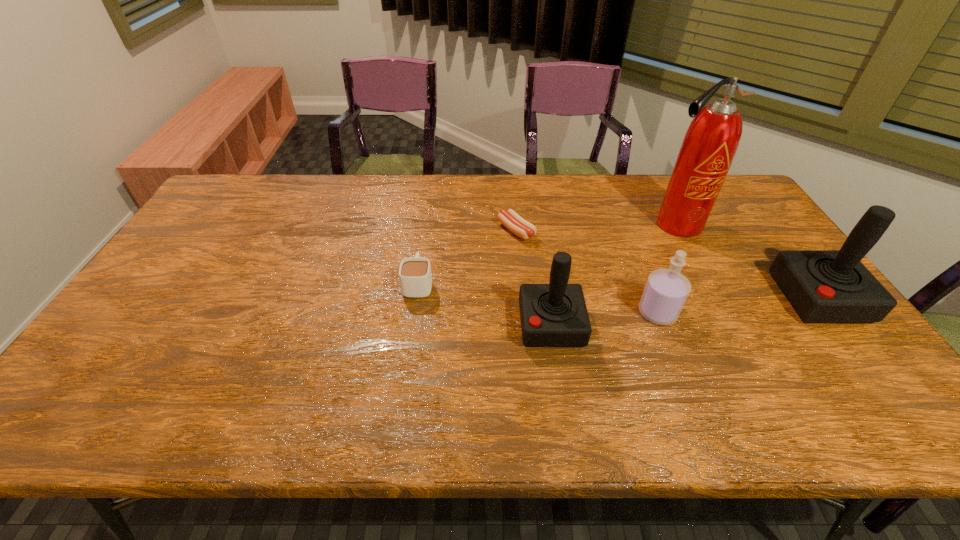
Where is `vacant area situated 0.240m on the back of the fourth object from left to right`? This screenshot has width=960, height=540. vacant area situated 0.240m on the back of the fourth object from left to right is located at coordinates (631, 242).

The width and height of the screenshot is (960, 540). In order to click on object located at the far edge in this screenshot , I will do `click(711, 141)`.

At what (x,y) coordinates should I click in order to perform the action: click on object that is at the right edge. Please return your answer as a coordinate pair (x, y). The width and height of the screenshot is (960, 540). Looking at the image, I should click on (823, 286).

The image size is (960, 540). I want to click on blank space at the far edge of the desktop, so click(x=552, y=179).

Where is `vacant space at the near edge of the desktop`? This screenshot has width=960, height=540. vacant space at the near edge of the desktop is located at coordinates (660, 355).

This screenshot has width=960, height=540. In order to click on vacant space at the far left corner of the desktop in this screenshot , I will do click(x=249, y=186).

At what (x,y) coordinates should I click in order to perform the action: click on blank space at the near left corner of the desktop. Please return your answer as a coordinate pair (x, y). Looking at the image, I should click on (142, 357).

This screenshot has height=540, width=960. Identify the location of free space at the far right corner. (732, 185).

The width and height of the screenshot is (960, 540). I want to click on vacant area that lies between the left joystick and the tallest object, so click(613, 274).

The height and width of the screenshot is (540, 960). I want to click on free space that is in between the taller joystick and the fifth object from left to right, so click(x=747, y=261).